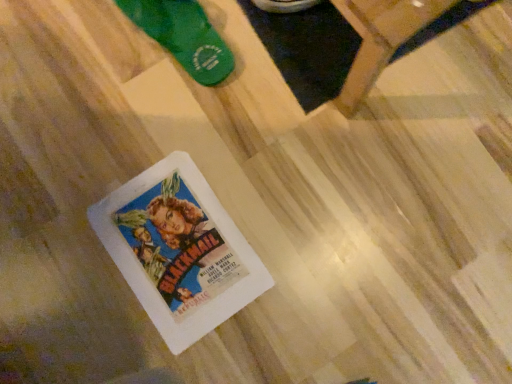
Where is `vacant region to the left of green rubber slipper at upper center`? vacant region to the left of green rubber slipper at upper center is located at coordinates (74, 47).